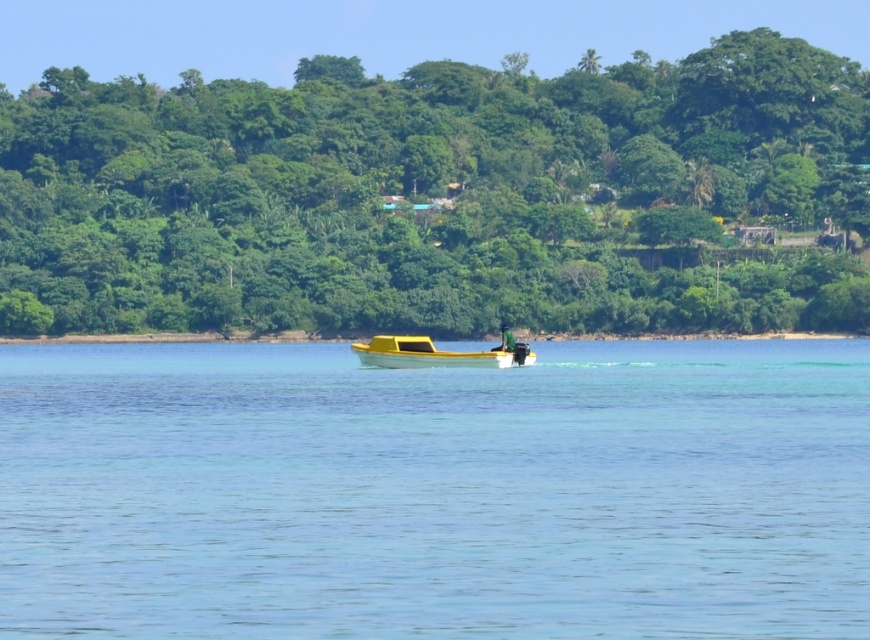
You are standing at the point marked by the coordinates point (435, 195) in the coastal scene. What object is located exactly at this point?

The point (435, 195) marks the green leafy tree at center.

You are standing on the shore looking at the clear blue water at center and the yellow matte boat at center. Which object is closer to you?

The yellow matte boat at center is closer to you because it is positioned above the clear blue water at center, which is located underneath it.